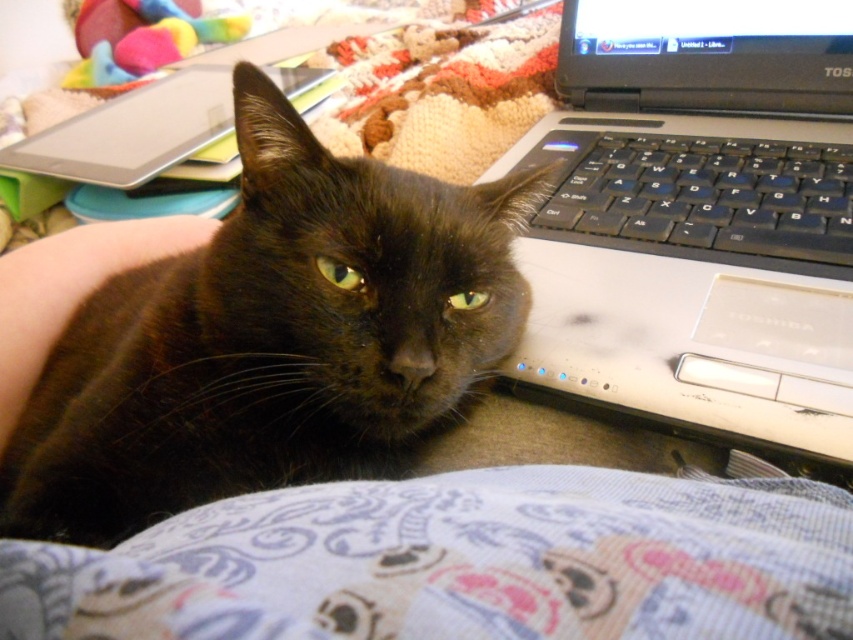
Is black plastic keyboard at right below soft plush toy at upper left?

Yes.

Can you confirm if black plastic keyboard at right is wider than soft plush toy at upper left?

In fact, black plastic keyboard at right might be narrower than soft plush toy at upper left.

Does point (641, 173) come farther from viewer compared to point (129, 26)?

No, it is not.

Locate an element on the screen. black plastic keyboard at right is located at coordinates (701, 198).

What do you see at coordinates (271, 339) in the screenshot?
I see `black glossy cat at upper left` at bounding box center [271, 339].

Which is above, black glossy cat at upper left or silver metallic laptop at center?

silver metallic laptop at center is higher up.

This screenshot has height=640, width=853. Find the location of `black glossy cat at upper left`. black glossy cat at upper left is located at coordinates (271, 339).

Which of these two, silver metallic laptop at center or black plastic keyboard at right, stands taller?

Standing taller between the two is silver metallic laptop at center.

Is silver metallic laptop at center above black plastic keyboard at right?

No, silver metallic laptop at center is not above black plastic keyboard at right.

Where is `silver metallic laptop at center`? This screenshot has height=640, width=853. silver metallic laptop at center is located at coordinates (698, 216).